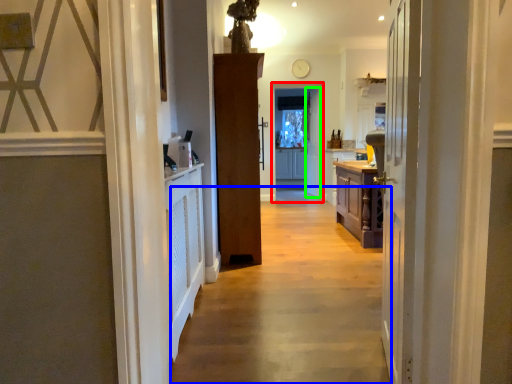
Question: Which object is positioned farthest from screen door (highlighted by a red box)? Select from path (highlighted by a blue box) and door (highlighted by a green box).

Choices:
 (A) path
 (B) door

Answer: (A)